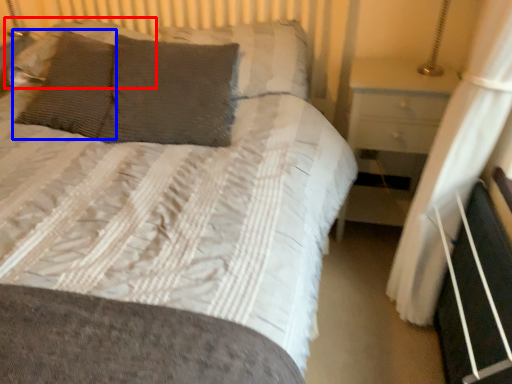
Question: Which object is further to the camera taking this photo, pillow (highlighted by a red box) or pillow (highlighted by a blue box)?

Choices:
 (A) pillow
 (B) pillow

Answer: (A)